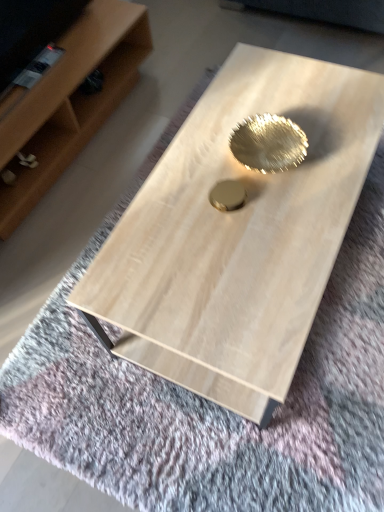
Image resolution: width=384 pixels, height=512 pixels. In order to click on free space in front of light wood coffee table at center in this screenshot , I will do `click(263, 422)`.